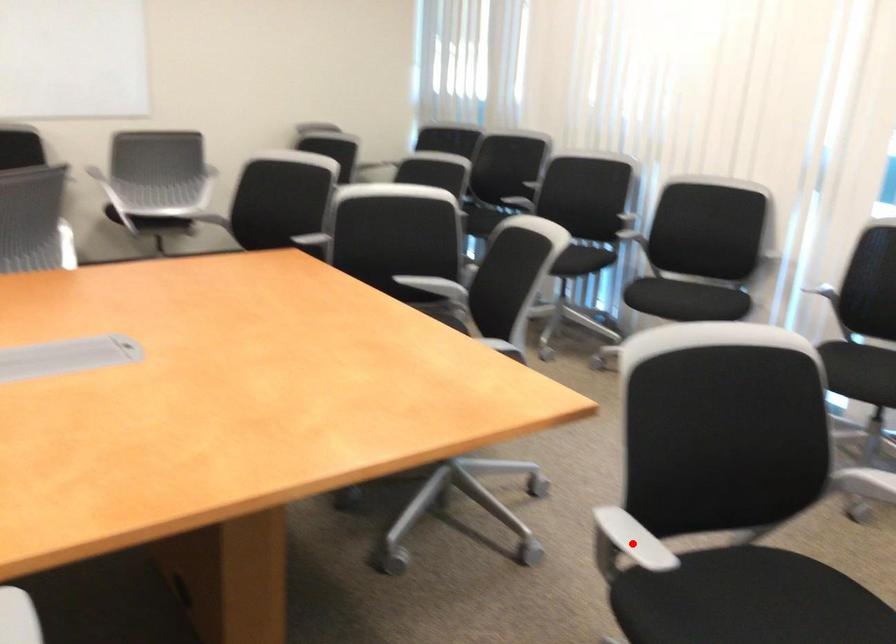
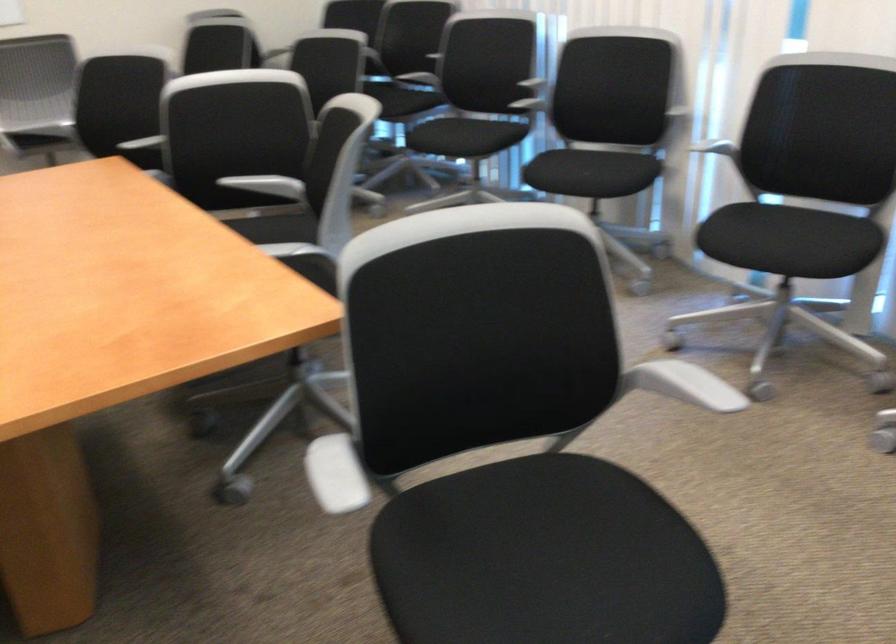
Find the pixel in the second image that matches the highlighted location in the first image.

(334, 474)